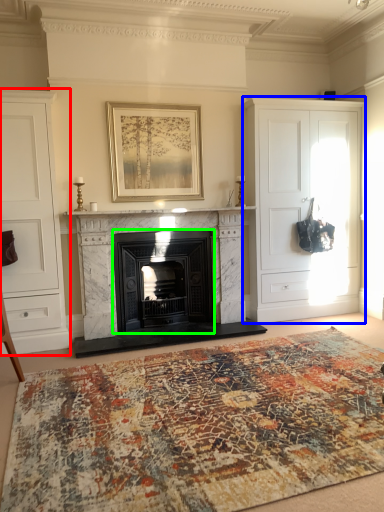
Question: Which object is positioned closest to cabinetry (highlighted by a red box)? Select from cabinetry (highlighted by a blue box) and wood burning stove (highlighted by a green box).

Choices:
 (A) cabinetry
 (B) wood burning stove

Answer: (B)